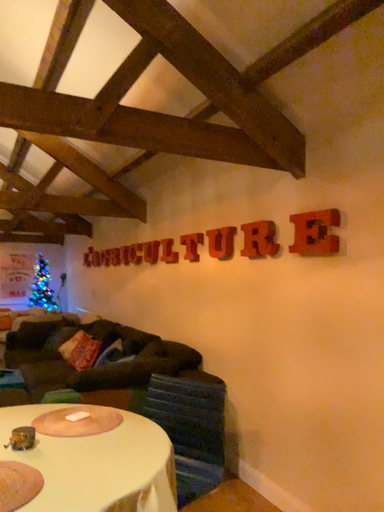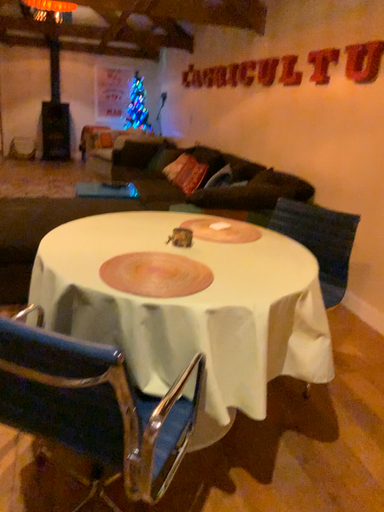
Question: How did the camera likely rotate when shooting the video?

Choices:
 (A) rotated upward
 (B) rotated downward

Answer: (B)